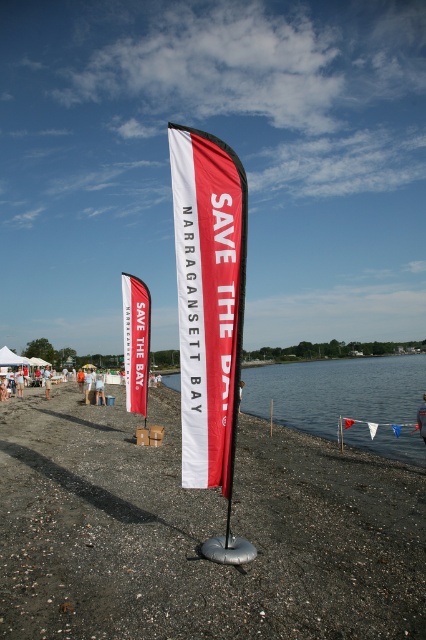
You are standing at the beach and see two points marked on the sand. The first point is at coordinates point (408,394) and the second is at point (126,358). Which point is closer to you?

Point (408,394) is further to the camera than point (126,358), so the closer point to you is point (126,358).

You are standing on the beach and want to place a small flag between the black gravel sand at center and the transparent water at lower center. Which object will the flag be closer to?

The flag will be closer to the transparent water at lower center because the black gravel sand at center is not as tall as the transparent water at lower center, meaning the sand is lower in elevation.